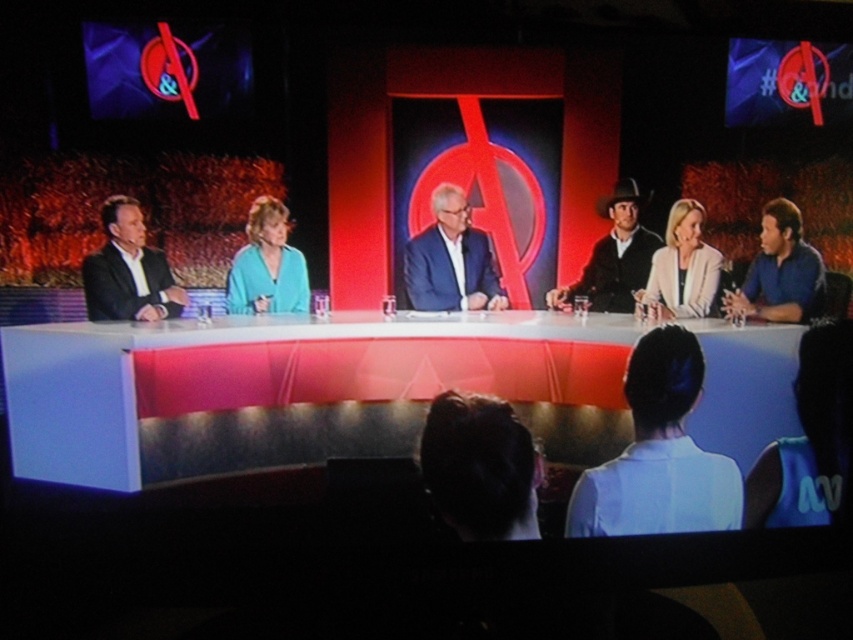
Between white glossy table at center and blue suit at center, which one has more height?

With more height is white glossy table at center.

Identify the location of white glossy table at center. (294, 390).

Is dark brown hair at lower center above black leather cowboy hat at center?

No.

Can you confirm if dark brown hair at lower center is thinner than black leather cowboy hat at center?

Incorrect, dark brown hair at lower center's width is not less than black leather cowboy hat at center's.

Is point (467, 401) positioned before point (631, 202)?

That is False.

Locate an element on the screen. The image size is (853, 640). dark brown hair at lower center is located at coordinates (480, 467).

Is point (132, 202) behind point (247, 260)?

No, it is not.

Which is below, matte black suit at left or teal fabric jacket at center?

matte black suit at left is lower down.

The height and width of the screenshot is (640, 853). Identify the location of matte black suit at left. (128, 269).